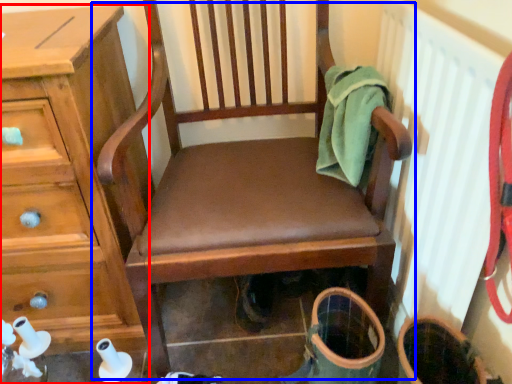
Question: Among these objects, which one is farthest to the camera, chest of drawers (highlighted by a red box) or chair (highlighted by a blue box)?

Choices:
 (A) chest of drawers
 (B) chair

Answer: (A)